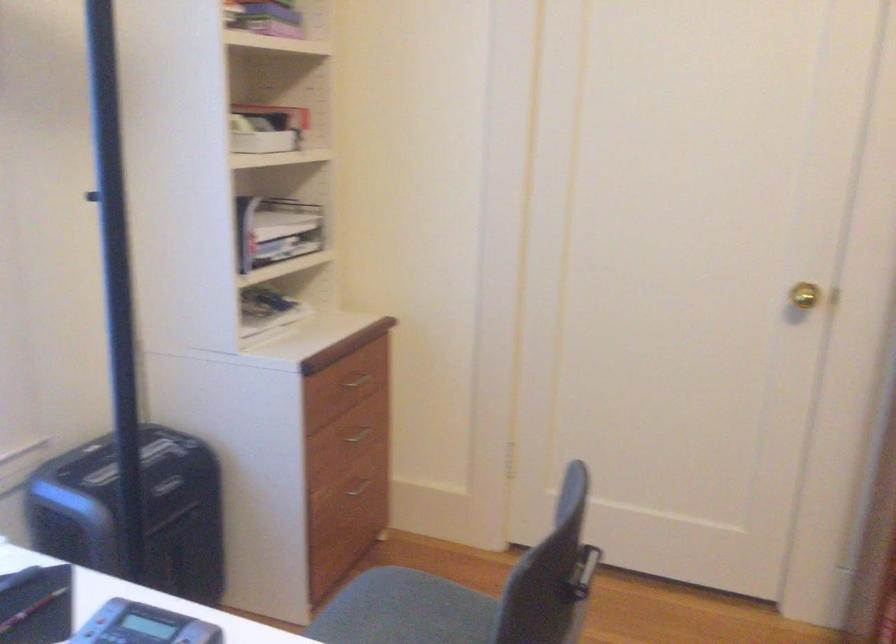
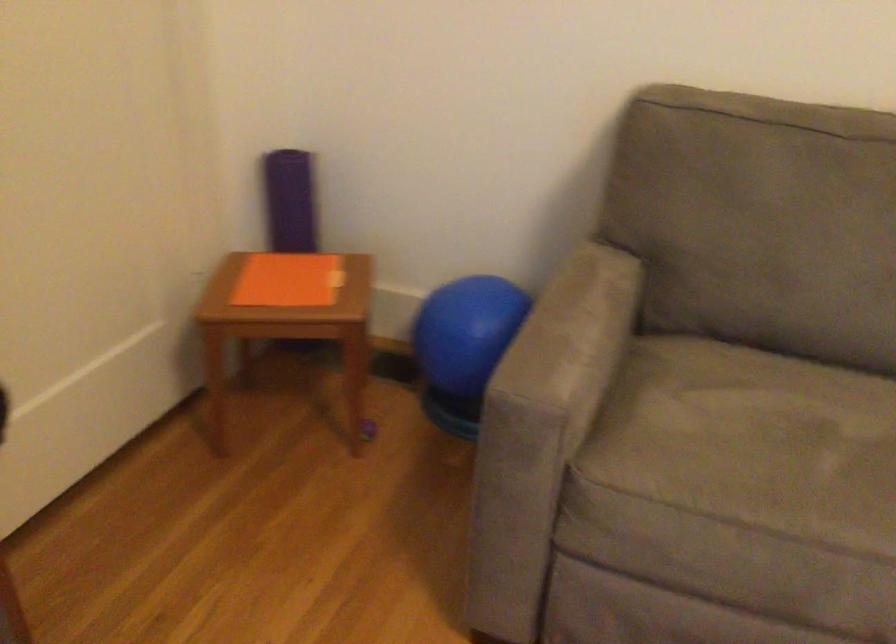
Based on the continuous images, in which direction is the camera rotating?

The camera rotated toward right-down.